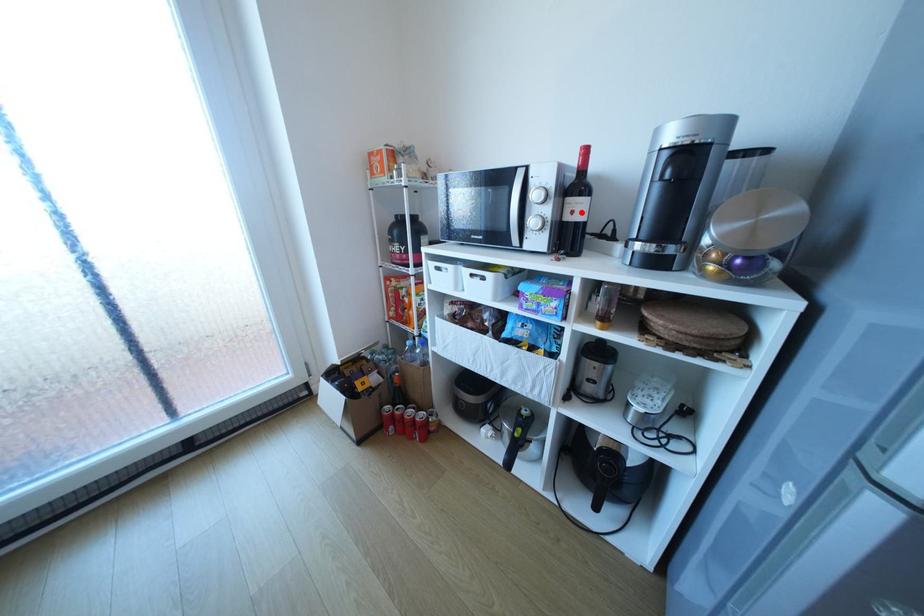
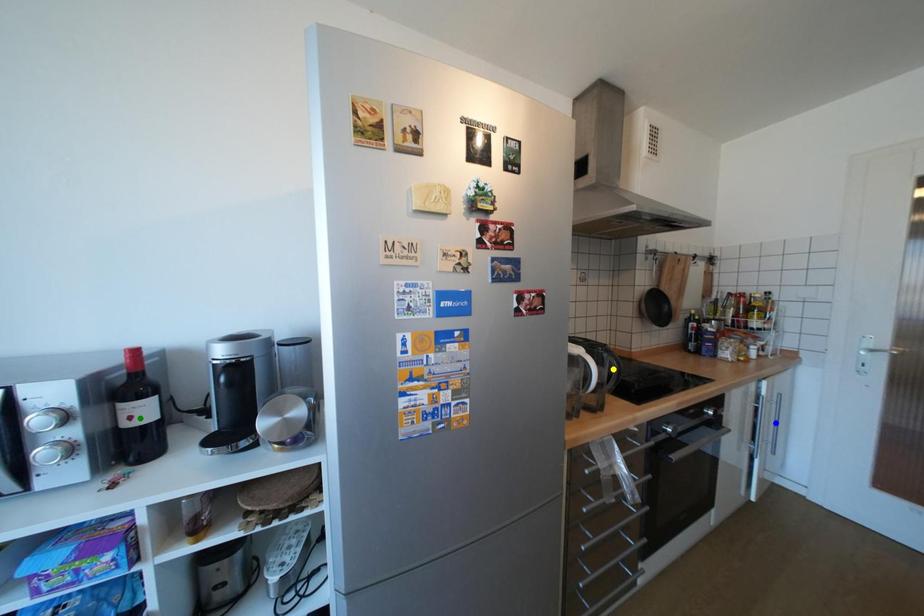
Question: I am providing you with two images of the same scene from different viewpoints. A red point is marked on the first image. You are given multiple points on the second image. Which point in image 2 is actually the same real-world point as the red point in image 1?

Choices:
 (A) blue point
 (B) yellow point
 (C) green point

Answer: (C)